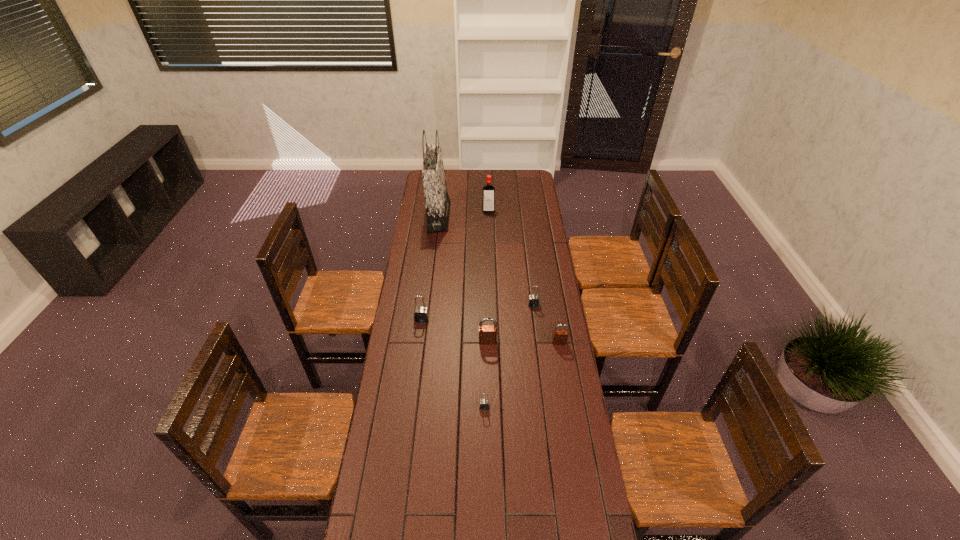
You are a GUI agent. You are given a task and a screenshot of the screen. Output one action in this format:
    pyautogui.click(x=<x>, y=<y>)
    Task: Click on the tallest object
    
    Given the screenshot: What is the action you would take?
    pyautogui.click(x=437, y=202)

Identify the location of vodka. This screenshot has height=540, width=960. (488, 192).

Locate an element on the screen. the second tallest object is located at coordinates pyautogui.click(x=488, y=192).

Identify the location of the biggest gray padlock. This screenshot has width=960, height=540. (421, 314).

Identify the location of the leftmost padlock. This screenshot has height=540, width=960. (421, 314).

The height and width of the screenshot is (540, 960). Find the location of `the left brown padlock`. the left brown padlock is located at coordinates (487, 333).

Find the location of a particular element. The width and height of the screenshot is (960, 540). the fifth nearest object is located at coordinates (533, 300).

The height and width of the screenshot is (540, 960). I want to click on the second padlock from right to left, so click(533, 300).

This screenshot has width=960, height=540. Find the location of `the rightmost padlock`. the rightmost padlock is located at coordinates pos(560,337).

Where is `the smaller brown padlock`? This screenshot has width=960, height=540. the smaller brown padlock is located at coordinates (560, 337).